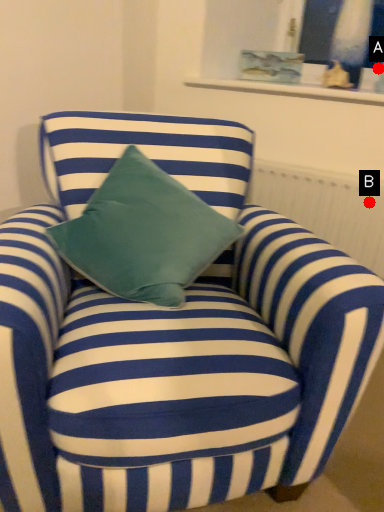
Question: Two points are circled on the image, labeled by A and B beside each circle. Among these points, which one is farthest from the camera?

Choices:
 (A) A is further
 (B) B is further

Answer: (A)